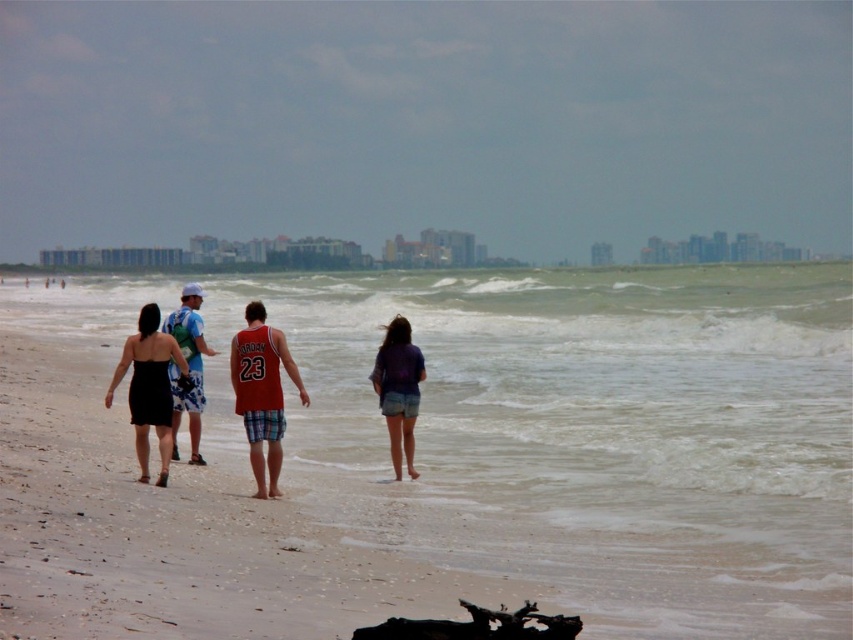
Question: Among these points, which one is farthest from the camera?

Choices:
 (A) (396, 637)
 (B) (383, 413)

Answer: (B)

Question: Does black matte dress at left have a lesser width compared to black wood at lower center?

Choices:
 (A) no
 (B) yes

Answer: (B)

Question: Among these points, which one is nearest to the camera?

Choices:
 (A) (376, 385)
 (B) (367, 632)
 (C) (380, 305)
 (D) (177, 356)

Answer: (B)

Question: Is matte red jersey at center bigger than white cap at center?

Choices:
 (A) no
 (B) yes

Answer: (A)

Question: Based on their relative distances, which object is farther from the greenish water at center?

Choices:
 (A) white cap at center
 (B) black matte dress at left

Answer: (B)

Question: Observing the image, what is the correct spatial positioning of greenish water at center in reference to purple cotton shirt at center?

Choices:
 (A) below
 (B) above

Answer: (B)